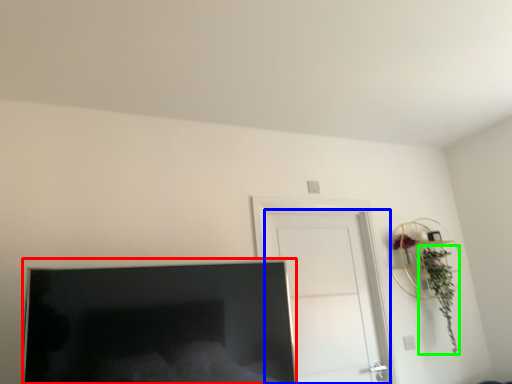
Question: Based on their relative distances, which object is farther from television (highlighted by a red box)? Choose from door (highlighted by a blue box) and plant (highlighted by a green box).

Choices:
 (A) door
 (B) plant

Answer: (B)